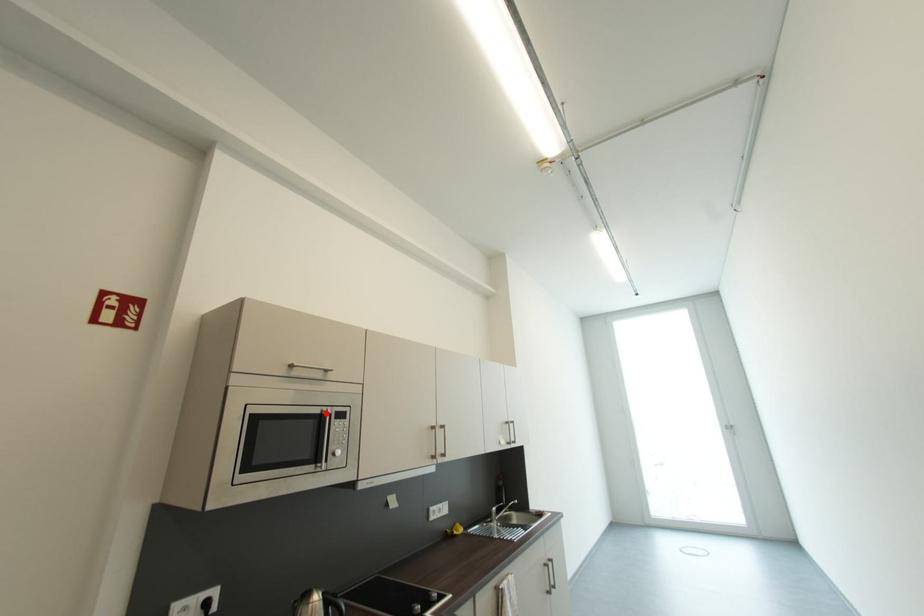
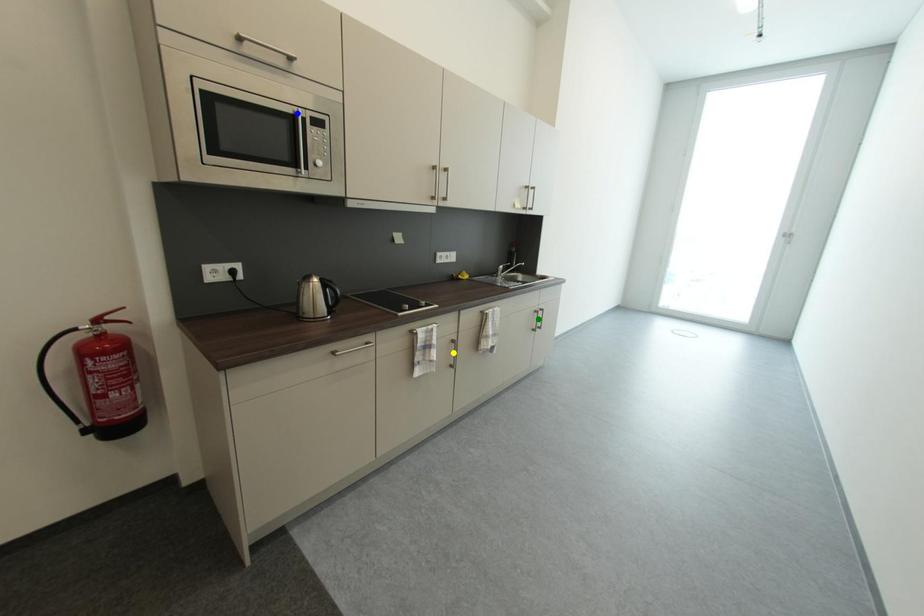
Question: I am providing you with two images of the same scene from different viewpoints. A red point is marked on the first image. You are given multiple points on the second image. Can you choose the point in image 2 that corresponds to the point in image 1?

Choices:
 (A) green point
 (B) yellow point
 (C) blue point

Answer: (C)